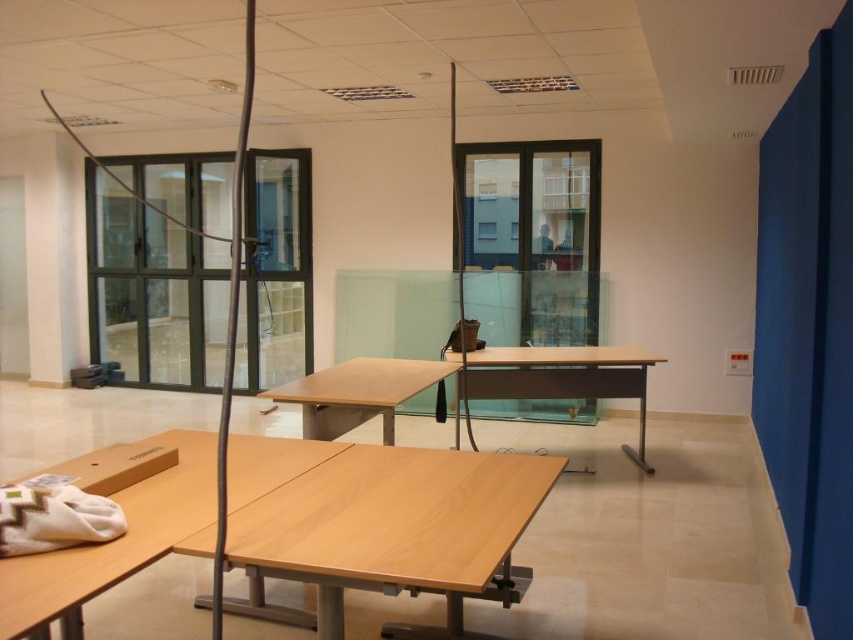
Can you confirm if transparent glass door at center is bigger than light brown wooden table at lower center?

Correct, transparent glass door at center is larger in size than light brown wooden table at lower center.

Is transparent glass door at center closer to camera compared to light brown wooden table at lower center?

No, it is not.

Does point (468, 218) lie in front of point (84, 580)?

No, it is behind (84, 580).

Where is `transparent glass door at center`? transparent glass door at center is located at coordinates (532, 237).

Which is behind, point (265, 157) or point (115, 573)?

The point (265, 157) is behind.

Does clear glass door at center appear on the left side of light brown wooden table at lower center?

Yes, clear glass door at center is to the left of light brown wooden table at lower center.

The image size is (853, 640). Describe the element at coordinates (154, 292) in the screenshot. I see `clear glass door at center` at that location.

Image resolution: width=853 pixels, height=640 pixels. In order to click on clear glass door at center in this screenshot , I will do `click(154, 292)`.

Who is more distant from viewer, (73, 470) or (277, 394)?

Positioned behind is point (277, 394).

Does point (341, 449) come farther from viewer compared to point (361, 397)?

No.

Who is more forward, (173, 531) or (368, 406)?

Point (173, 531)

You are a GUI agent. You are given a task and a screenshot of the screen. Output one action in this format:
    pyautogui.click(x=<x>, y=<y>)
    Task: Click on the light brown wooden table at lower center
    Image resolution: width=853 pixels, height=640 pixels.
    Given the screenshot: What is the action you would take?
    click(119, 538)